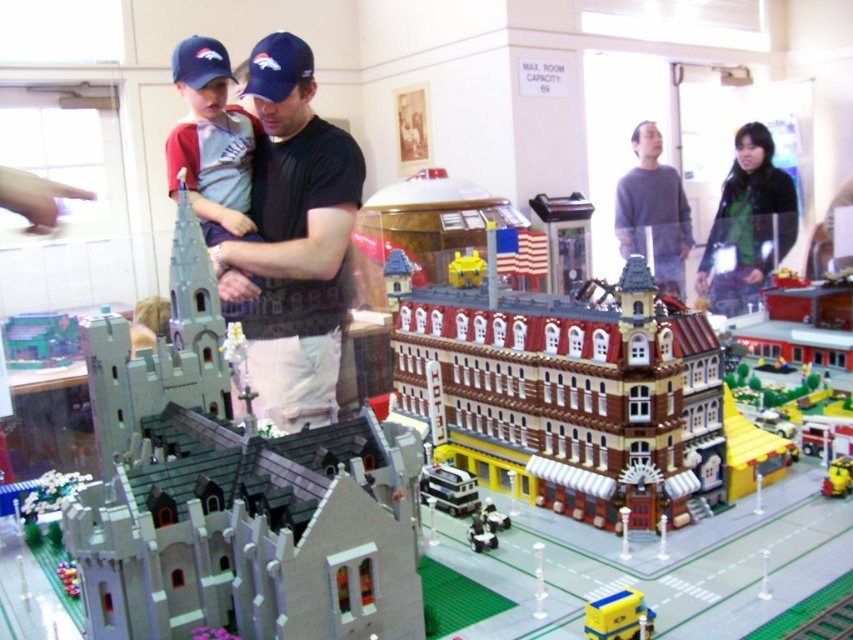
You are a Lego figure standing on the green Lego baseplate. You see the gray sweater at upper center and the yellow plastic car at center. Which object is taller?

The gray sweater at upper center is taller than the yellow plastic car at center according to the description.

You are a Lego figure standing on the green Lego baseplate. You see the gray sweater at upper center and the yellow plastic car at center. Which object is closer to you?

The gray sweater at upper center is closer to you because it is further to the viewer than the yellow plastic car at center.